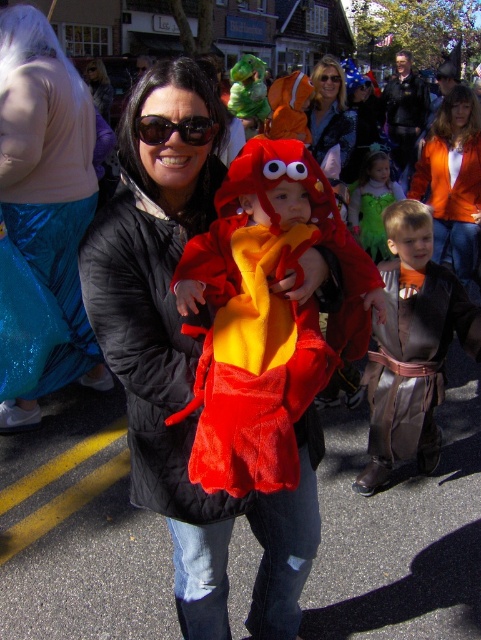
Question: Based on their relative distances, which object is farther from the orange fabric jacket at upper center?

Choices:
 (A) green satin dress at center
 (B) sunglassesmaterial/texture at upper center
 (C) shiny teal skirt at lower left
 (D) black plastic sunglasses at center

Answer: (D)

Question: Which object is closer to the camera taking this photo?

Choices:
 (A) sunglassesmaterial/texture at upper center
 (B) black plastic sunglasses at center
 (C) green satin dress at center

Answer: (B)

Question: Which point appears farthest from the camera in this image?

Choices:
 (A) (433, 156)
 (B) (393, 195)
 (C) (185, 132)

Answer: (B)

Question: Can you confirm if shiny teal skirt at lower left is positioned to the left of green satin dress at center?

Choices:
 (A) yes
 (B) no

Answer: (A)

Question: Is shiny teal skirt at lower left positioned behind black plastic sunglasses at center?

Choices:
 (A) yes
 (B) no

Answer: (A)

Question: Can you confirm if orange fabric jacket at upper center is smaller than black plastic sunglasses at center?

Choices:
 (A) no
 (B) yes

Answer: (A)